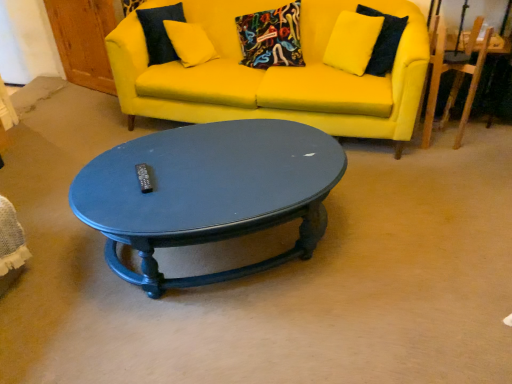
At what (x,y) coordinates should I click in order to perform the action: click on free space in front of wooden armchair at right. Please return your answer as a coordinate pair (x, y). The image size is (512, 384). Looking at the image, I should click on (450, 158).